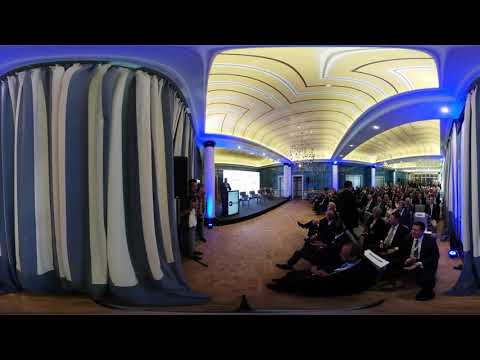
At what (x,y) coordinates should I click in order to perform the action: click on curtain. Please return your answer as a coordinate pair (x, y). This screenshot has height=360, width=480. Looking at the image, I should click on (126, 169), (463, 158).